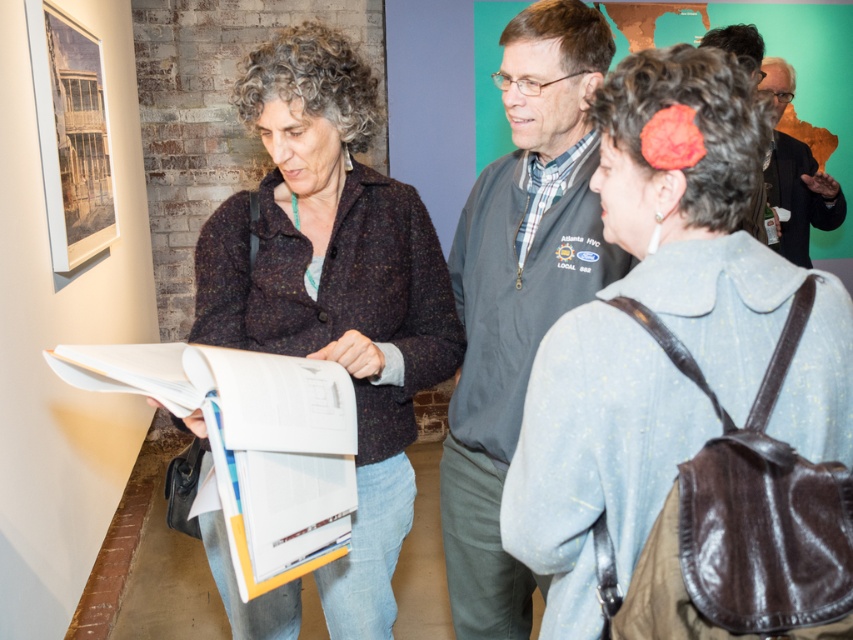
Question: Is speckled wool sweater at center closer to camera compared to gray fleece vest at center?

Choices:
 (A) no
 (B) yes

Answer: (B)

Question: Can you confirm if denim jacket at center is positioned above matte gray jacket at upper right?

Choices:
 (A) no
 (B) yes

Answer: (A)

Question: Which of the following is the closest to the observer?

Choices:
 (A) pyautogui.click(x=779, y=205)
 (B) pyautogui.click(x=611, y=291)
 (C) pyautogui.click(x=264, y=348)
 (D) pyautogui.click(x=546, y=147)

Answer: (B)

Question: Which point is closer to the camera?

Choices:
 (A) (772, 88)
 (B) (346, 49)

Answer: (B)

Question: Which object is closer to the camera taking this photo?

Choices:
 (A) gray fleece vest at center
 (B) matte gray jacket at upper right
 (C) speckled wool sweater at center

Answer: (C)

Question: Does gray fleece vest at center have a greater width compared to matte gray jacket at upper right?

Choices:
 (A) yes
 (B) no

Answer: (B)